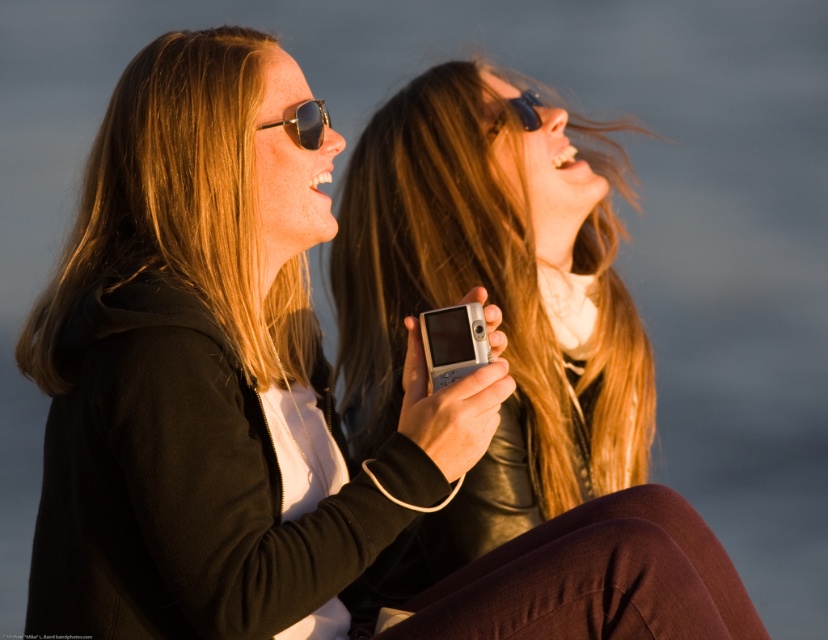
Can you confirm if metallic reflective sunglasses at upper center is wider than black plastic goggles at upper center?

In fact, metallic reflective sunglasses at upper center might be narrower than black plastic goggles at upper center.

Who is positioned more to the right, metallic reflective sunglasses at upper center or black plastic goggles at upper center?

Positioned to the right is black plastic goggles at upper center.

Who is more forward, (x=266, y=128) or (x=504, y=122)?

Point (x=266, y=128) is in front.

The image size is (828, 640). Identify the location of metallic reflective sunglasses at upper center. [x=307, y=122].